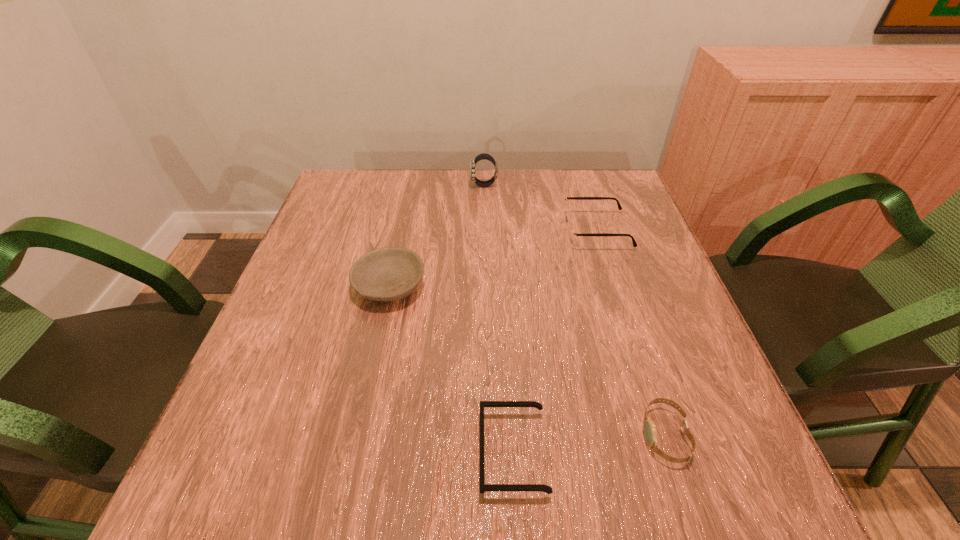
Where is `free space between the sunglasses and the right watch`? free space between the sunglasses and the right watch is located at coordinates (588, 444).

Where is `vacant area that lies between the second farthest object and the bowl`? The height and width of the screenshot is (540, 960). vacant area that lies between the second farthest object and the bowl is located at coordinates (492, 258).

Locate an element on the screen. This screenshot has width=960, height=540. free space between the shortest object and the shorter watch is located at coordinates (588, 444).

Locate an element on the screen. free space between the leftmost object and the right watch is located at coordinates (527, 361).

Locate an element on the screen. free space that is in between the tallest object and the nearer watch is located at coordinates (574, 310).

Where is `vacant region between the spectacles and the nearer watch`? This screenshot has width=960, height=540. vacant region between the spectacles and the nearer watch is located at coordinates (631, 333).

Locate an element on the screen. The height and width of the screenshot is (540, 960). free area in between the bowl and the second farthest object is located at coordinates (492, 258).

Image resolution: width=960 pixels, height=540 pixels. In order to click on free point between the right watch and the farthest object in this screenshot , I will do `click(574, 310)`.

You are a GUI agent. You are given a task and a screenshot of the screen. Output one action in this format:
    pyautogui.click(x=<x>, y=<y>)
    Task: Click on the object identified as the fourth closest to the farthest object
    This screenshot has height=540, width=960.
    Given the screenshot: What is the action you would take?
    pyautogui.click(x=649, y=428)

Locate which object ranks third in proximity to the shorter watch. Please provide its 2D coordinates. Your answer should be formatted as a tuple, i.e. [(x, y)], where the tuple contains the x and y coordinates of a point satisfying the conditions above.

[(386, 274)]